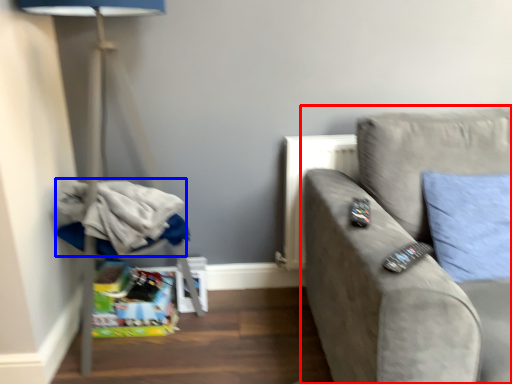
Question: Among these objects, which one is nearest to the camera, studio couch (highlighted by a red box) or laundry (highlighted by a blue box)?

Choices:
 (A) studio couch
 (B) laundry

Answer: (A)